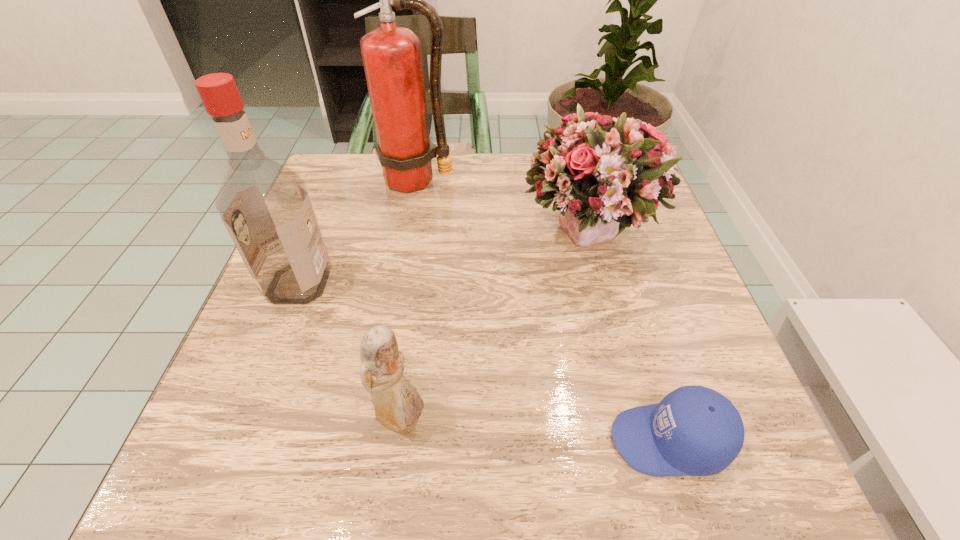
Where is `object located in the far left corner section of the desktop`? This screenshot has height=540, width=960. object located in the far left corner section of the desktop is located at coordinates (392, 56).

Image resolution: width=960 pixels, height=540 pixels. In order to click on object located in the far right corner section of the desktop in this screenshot , I will do `click(604, 174)`.

Locate an element on the screen. object present at the near right corner is located at coordinates (693, 431).

Locate an element on the screen. The width and height of the screenshot is (960, 540). vacant region at the far edge of the desktop is located at coordinates (410, 204).

Locate an element on the screen. vacant space at the near edge is located at coordinates (316, 457).

This screenshot has height=540, width=960. In the image, there is a desktop. In order to click on vacant area at the left edge in this screenshot , I will do `click(309, 419)`.

In the image, there is a desktop. Identify the location of free space at the right edge. [x=655, y=363].

In the image, there is a desktop. Where is `vacant space at the far left corner`? Image resolution: width=960 pixels, height=540 pixels. vacant space at the far left corner is located at coordinates (378, 173).

Identify the location of unoccupied position between the leftmost object and the figurine. (349, 352).

What are the coordinates of `free spot between the cap and the third tallest object` in the screenshot? It's located at (629, 338).